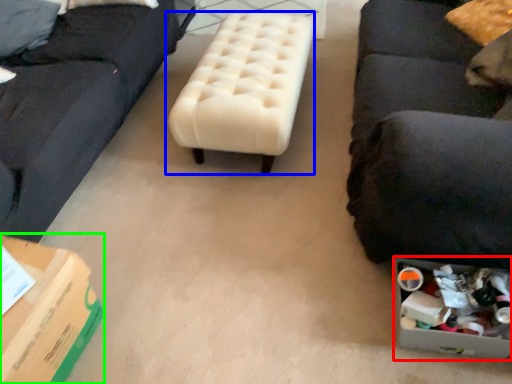
Question: Which object is the closest to the storage box (highlighted by a red box)? Choose among these: table (highlighted by a blue box) or cardboard box (highlighted by a green box).

Choices:
 (A) table
 (B) cardboard box

Answer: (A)